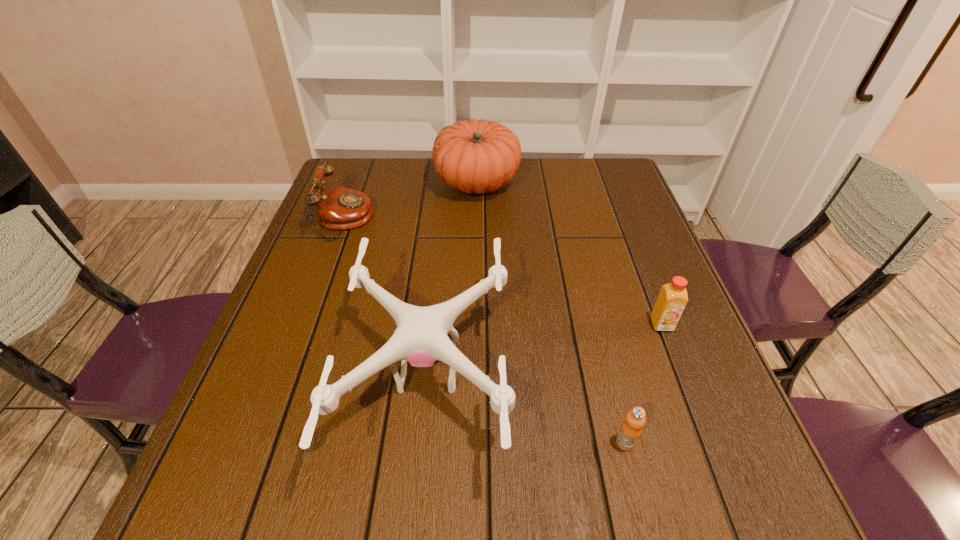
Locate an element on the screen. The width and height of the screenshot is (960, 540). vacant point located on the front and back of the rightmost object is located at coordinates (689, 396).

You are a GUI agent. You are given a task and a screenshot of the screen. Output one action in this format:
    pyautogui.click(x=<x>, y=<y>)
    Task: Click on the vacant point located on the front label of the left orange juice
    The width and height of the screenshot is (960, 540).
    Given the screenshot: What is the action you would take?
    pyautogui.click(x=638, y=495)

The image size is (960, 540). I want to click on pumpkin that is at the far edge, so click(x=474, y=156).

This screenshot has width=960, height=540. What are the coordinates of `telephone at the far edge` in the screenshot? It's located at (338, 208).

Where is `object located in the near edge section of the desktop`? Image resolution: width=960 pixels, height=540 pixels. object located in the near edge section of the desktop is located at coordinates (421, 339).

Where is `object that is positioned at the left edge`? This screenshot has width=960, height=540. object that is positioned at the left edge is located at coordinates (338, 208).

At what (x,y) coordinates should I click in order to perform the action: click on object positioned at the right edge. Please return your answer as a coordinate pair (x, y). Looking at the image, I should click on (672, 299).

Identify the location of object at the far left corner. The width and height of the screenshot is (960, 540). (338, 208).

I want to click on vacant space at the far edge, so click(x=398, y=190).

I want to click on vacant space at the near edge of the desktop, so click(464, 499).